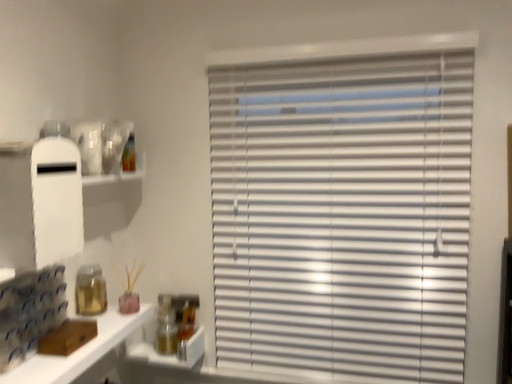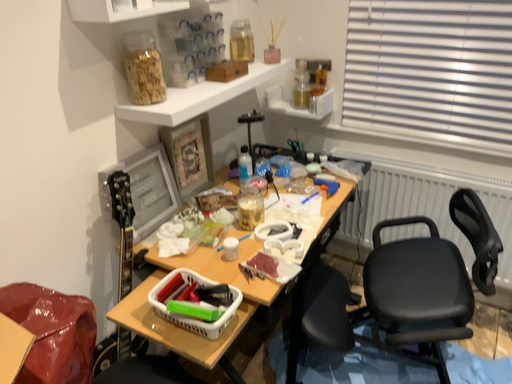
Question: How did the camera likely rotate when shooting the video?

Choices:
 (A) rotated upward
 (B) rotated downward

Answer: (B)